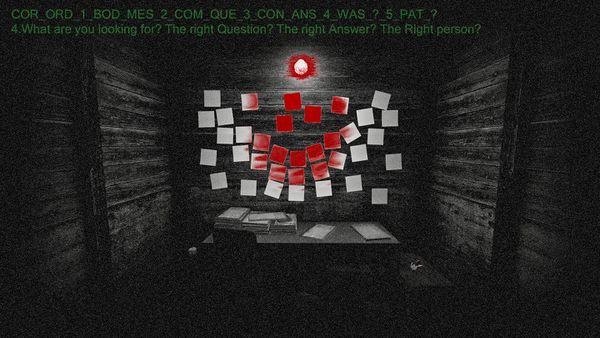
What are the coordinates of `desk chair` in the screenshot? It's located at (236, 256).